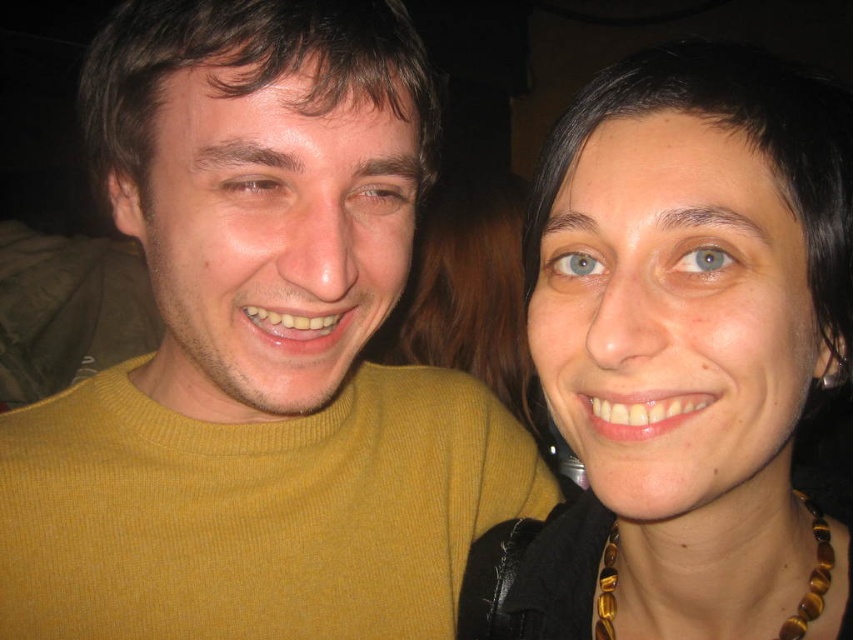
Is yellow ribbed sweater at left wider than brown matte eye at upper left?

Correct, the width of yellow ribbed sweater at left exceeds that of brown matte eye at upper left.

Which is below, yellow ribbed sweater at left or brown matte eye at upper left?

yellow ribbed sweater at left is below.

The image size is (853, 640). Describe the element at coordinates (257, 355) in the screenshot. I see `yellow ribbed sweater at left` at that location.

Where is `yellow ribbed sweater at left`? Image resolution: width=853 pixels, height=640 pixels. yellow ribbed sweater at left is located at coordinates (257, 355).

Between brown matte eye at upper center and blue glossy eye at upper center, which one has less height?

With less height is blue glossy eye at upper center.

Is the position of brown matte eye at upper center more distant than that of blue glossy eye at upper center?

Yes, it is behind blue glossy eye at upper center.

Which is behind, point (405, 182) or point (715, 268)?

Point (405, 182)

Where is `brown matte eye at upper center`? This screenshot has height=640, width=853. brown matte eye at upper center is located at coordinates (380, 195).

Does brown beaded necklace at upper right lie in front of blue matte eye at upper center?

Yes, brown beaded necklace at upper right is closer to the viewer.

Which is behind, point (679, 154) or point (579, 259)?

Positioned behind is point (579, 259).

Does point (628, 120) lie behind point (590, 268)?

No, (628, 120) is in front of (590, 268).

In order to click on brown beaded necklace at upper right in this screenshot , I will do `click(683, 360)`.